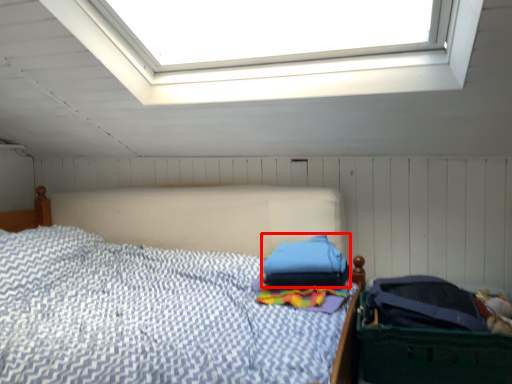
Question: From the image's perspective, considering the relative positions of pillow (annotated by the red box) and laundry basket in the image provided, where is pillow (annotated by the red box) located with respect to the staircase?

Choices:
 (A) above
 (B) below

Answer: (A)